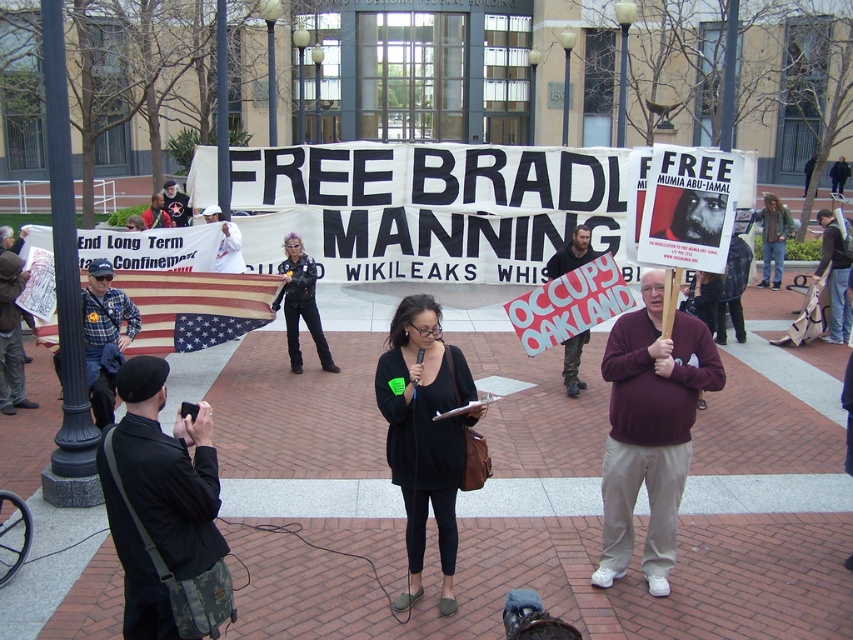
You are a photographer at the protest scene. You want to take a photo of the black matte dress at center and the black leather pants at center. Which object is closer to the camera?

The black matte dress at center is positioned under the black leather pants at center, so the black leather pants at center is closer to the camera.

You are a photographer at the protest trying to capture a clear photo of both the black matte dress at center and the black leather pants at center. Which one is closer to the camera?

The black matte dress at center is in front of the black leather pants at center, so the black matte dress at center is closer to the camera.